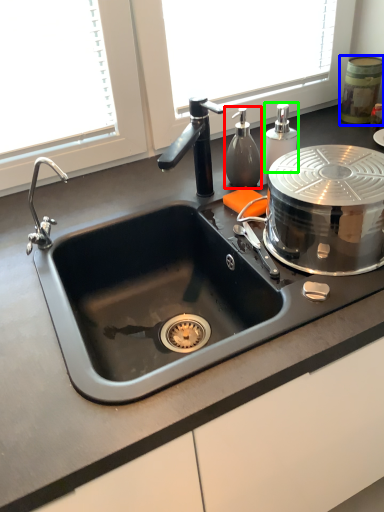
Question: Considering the real-world distances, which object is closest to soap dispenser (highlighted by a red box)? appliance (highlighted by a blue box) or soap dispenser (highlighted by a green box).

Choices:
 (A) appliance
 (B) soap dispenser

Answer: (B)